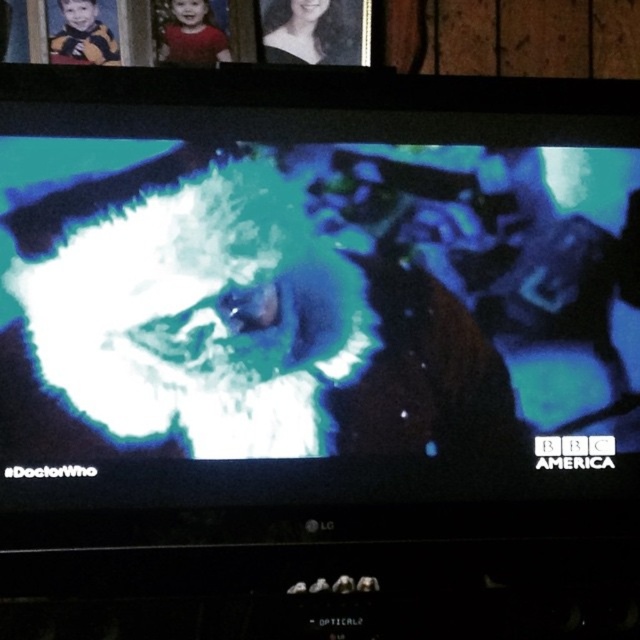
You are watching the TV screen and notice a point marked at coordinates (301,32). What does this point represent on the screen?

The point at coordinates (301,32) represents the black matte hair at upper center.